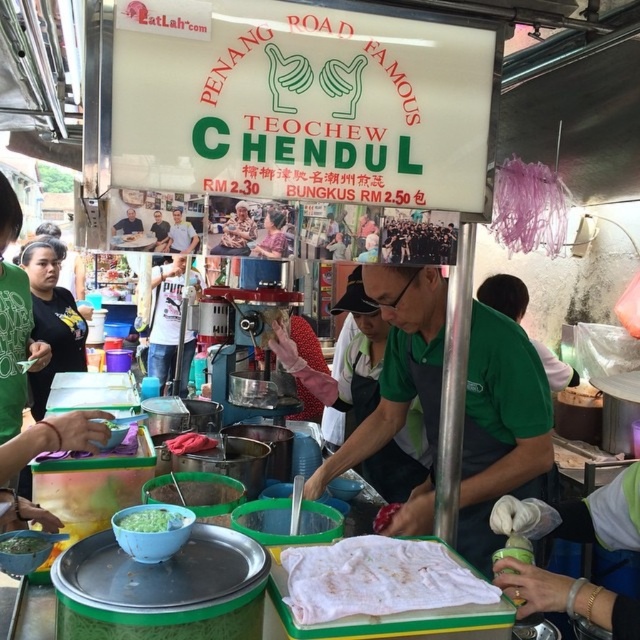
Is green fabric apron at center behind green matte bowl at lower left?

Yes.

Does green fabric apron at center have a greater height compared to green matte bowl at lower left?

Indeed, green fabric apron at center has a greater height compared to green matte bowl at lower left.

Where is `green fabric apron at center`? The width and height of the screenshot is (640, 640). green fabric apron at center is located at coordinates (500, 429).

You are a GUI agent. You are given a task and a screenshot of the screen. Output one action in this format:
    pyautogui.click(x=<x>, y=<y>)
    Task: Click on the green fabric apron at center
    
    Given the screenshot: What is the action you would take?
    pyautogui.click(x=500, y=429)

Measure the distance from light blue shirt at center to green matte bowl at lower left.

A distance of 76.41 centimeters exists between light blue shirt at center and green matte bowl at lower left.

Is light blue shirt at center thinner than green matte bowl at lower left?

Correct, light blue shirt at center's width is less than green matte bowl at lower left's.

Find the location of a particular element. The width and height of the screenshot is (640, 640). light blue shirt at center is located at coordinates (180, 234).

Which is above, black fabric shirt at left or light blue shirt at center?

Positioned higher is black fabric shirt at left.

Can you confirm if black fabric shirt at left is bigger than light blue shirt at center?

Correct, black fabric shirt at left is larger in size than light blue shirt at center.

Is point (44, 326) positioned before point (166, 237)?

No, (44, 326) is behind (166, 237).

You are a GUI agent. You are given a task and a screenshot of the screen. Output one action in this format:
    pyautogui.click(x=<x>, y=<y>)
    Task: Click on the black fabric shirt at left
    
    Given the screenshot: What is the action you would take?
    pyautogui.click(x=51, y=317)